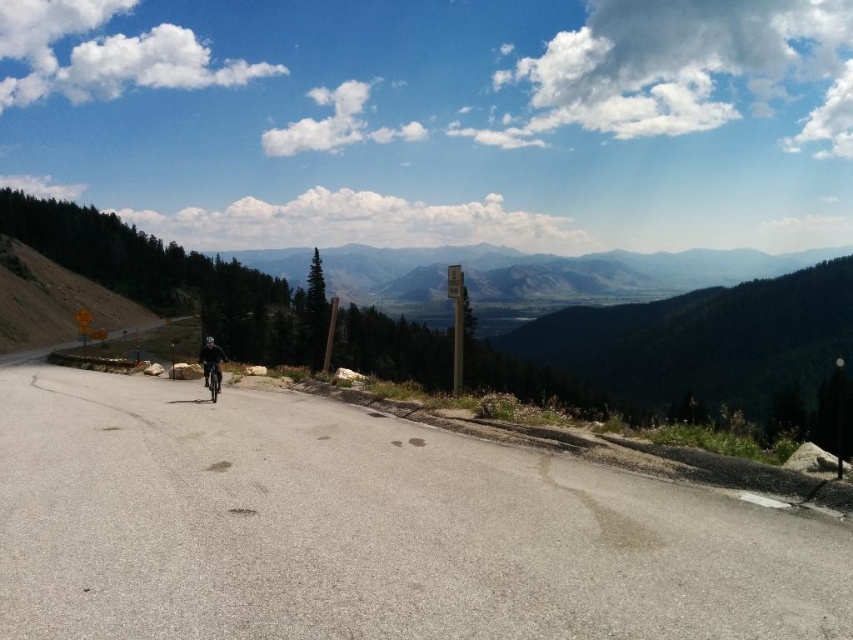
Question: Which object appears farthest from the camera in this image?

Choices:
 (A) dark gray helmet at center
 (B) shiny silver motorbike at center

Answer: (A)

Question: Which point appears farthest from the camera in this image?

Choices:
 (A) (207, 360)
 (B) (207, 355)

Answer: (B)

Question: Does gray asphalt road at center lie in front of shiny silver motorbike at center?

Choices:
 (A) no
 (B) yes

Answer: (B)

Question: Which object appears farthest from the camera in this image?

Choices:
 (A) shiny silver motorbike at center
 (B) gray asphalt road at center

Answer: (A)

Question: Is dark gray helmet at center below shiny silver motorbike at center?

Choices:
 (A) yes
 (B) no

Answer: (B)

Question: Can you confirm if dark gray helmet at center is positioned above shiny silver motorbike at center?

Choices:
 (A) no
 (B) yes

Answer: (B)